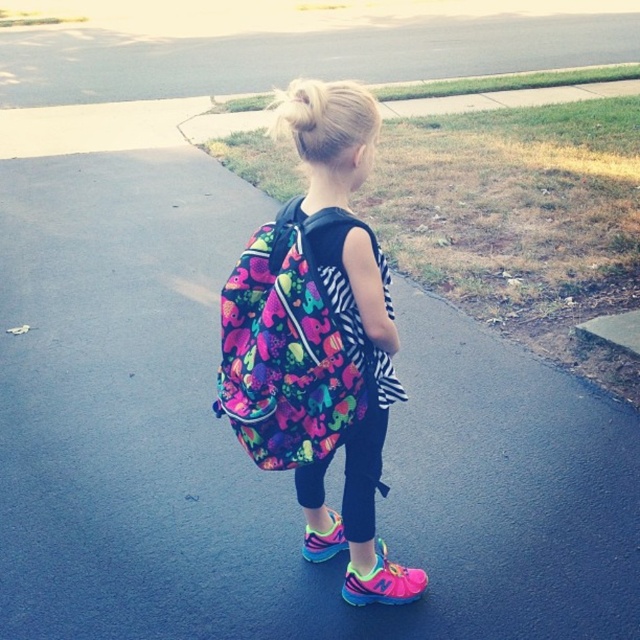
You are standing at the point marked by the coordinates point (316, 332). Looking around, you see the neon floral backpack at center. What object is located exactly at your current position?

The point (316, 332) indicates the location of the neon floral backpack at center.

You are a photographer trying to capture the multicolored fabric backpack at center and the green grass at upper center in a single frame. Based on their sizes, which object would appear smaller in the photo?

The multicolored fabric backpack at center would appear smaller in the photo since it has a smaller size compared to the green grass at upper center.

You are a photographer trying to capture the girl walking away. You notice the neon floral backpack at center and the blonde hair at upper center. Which object is wider in the image?

The neon floral backpack at center is wider than the blonde hair at upper center.